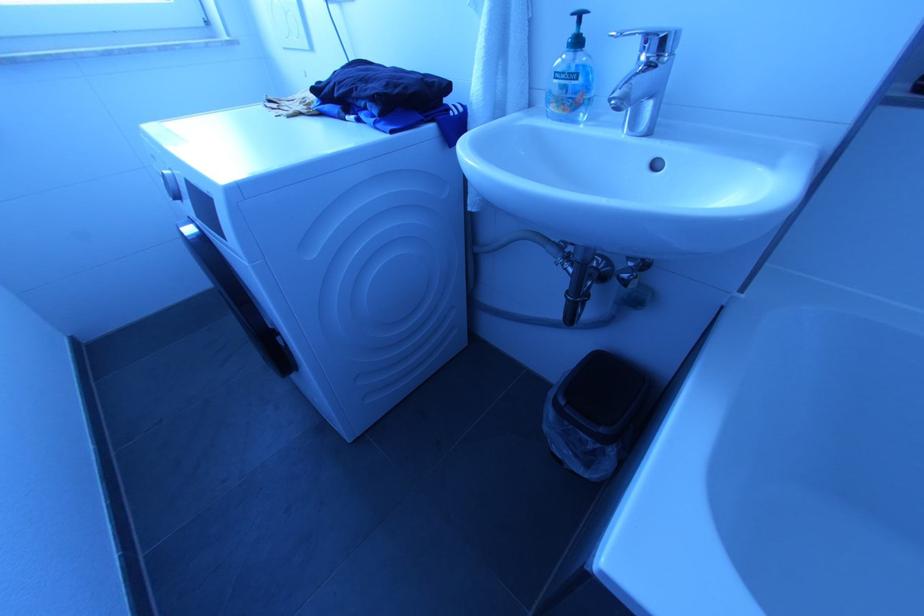
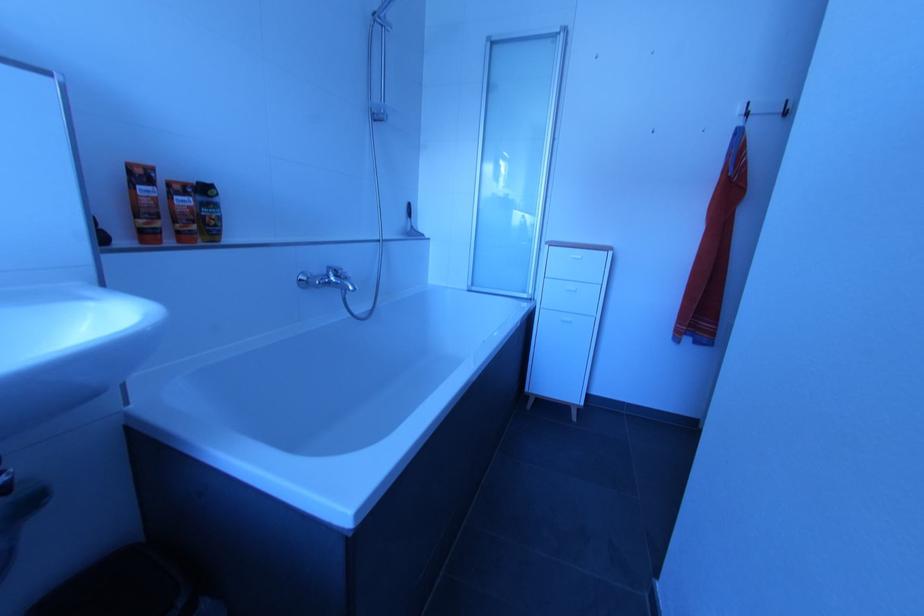
The images are taken continuously from a first-person perspective. In which direction is your viewpoint rotating?

The rotation direction of the camera is right-down.